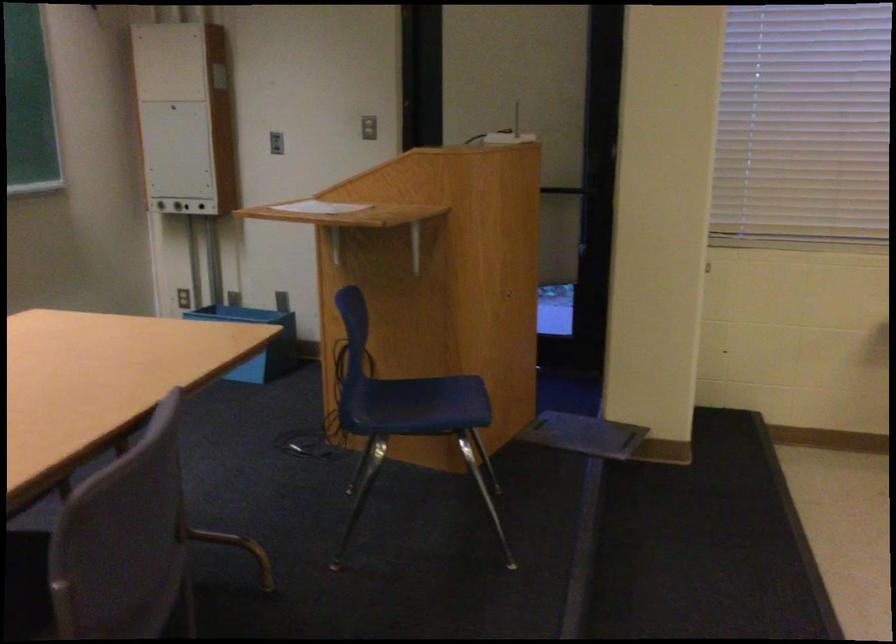
Which object does [320,207] point to?

This point indicates the white paper sheet.